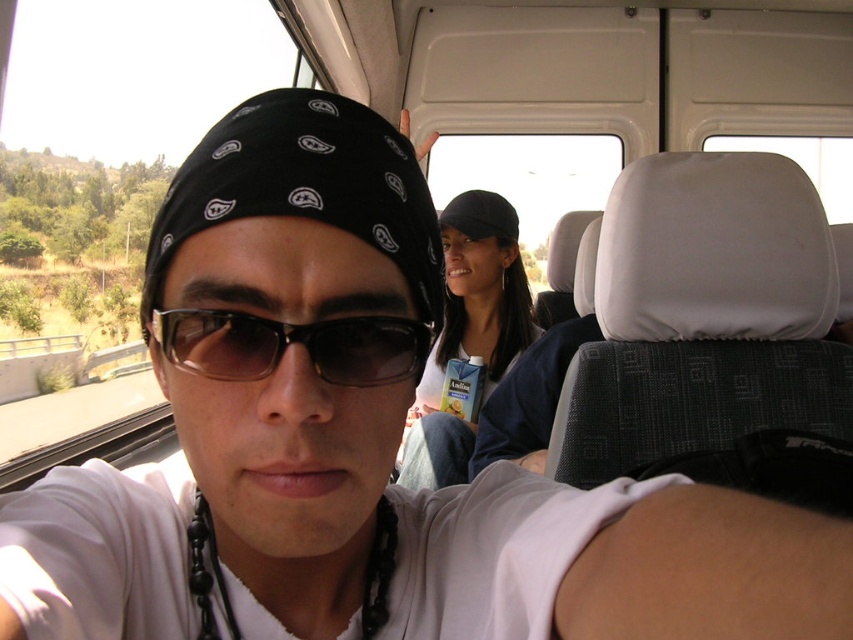
This screenshot has height=640, width=853. What do you see at coordinates (469, 332) in the screenshot? I see `matte black cap at center` at bounding box center [469, 332].

Does point (486, 250) come farther from viewer compared to point (219, 348)?

Yes.

Is point (421, 385) positioned in front of point (326, 344)?

No, it is not.

Find the location of a particular element. The image size is (853, 640). matte black cap at center is located at coordinates (469, 332).